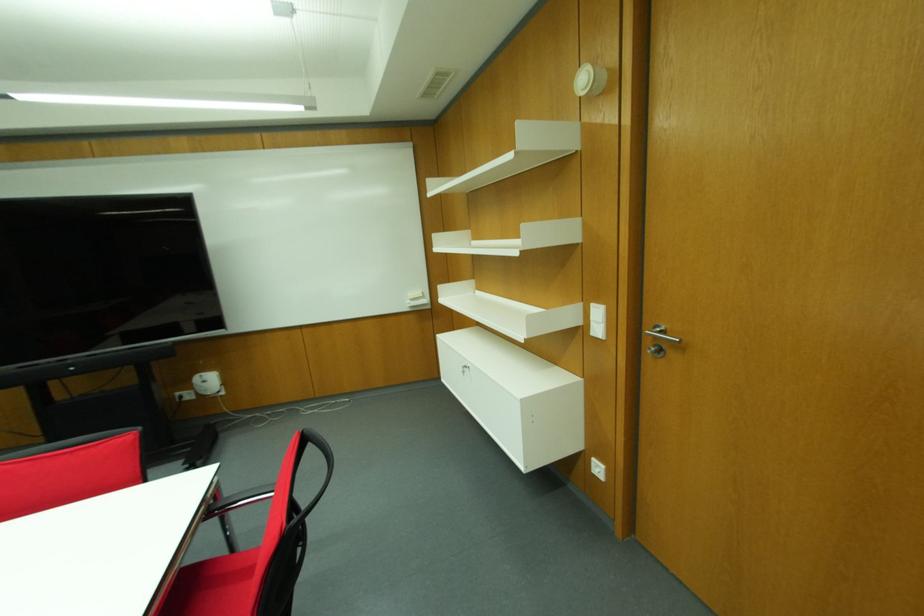
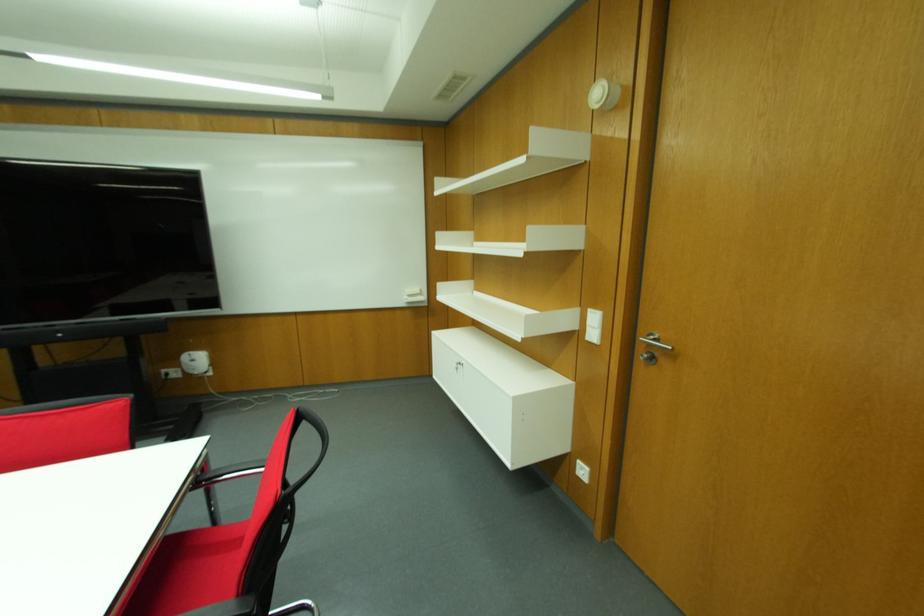
Find the pixel in the second image that matches (x=464, y=371) in the first image.

(456, 369)